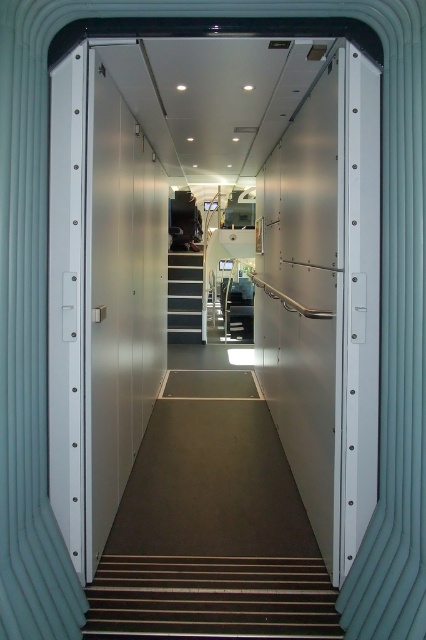
Between wooden stairs at lower center and white glossy stair at center, which one is positioned higher?

white glossy stair at center

Between wooden stairs at lower center and white glossy stair at center, which one appears on the left side from the viewer's perspective?

white glossy stair at center is more to the left.

Find the location of a particular element. This screenshot has height=640, width=426. wooden stairs at lower center is located at coordinates (210, 598).